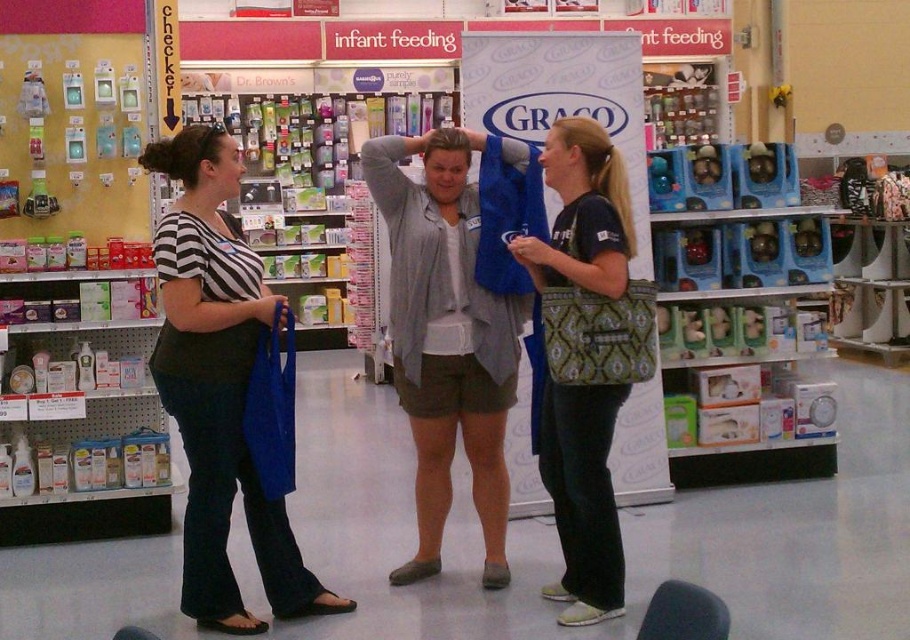
Question: Which of the following is the closest to the observer?

Choices:
 (A) (603, 605)
 (B) (228, 397)

Answer: (B)

Question: Can you confirm if matte black shirt at left is thinner than matte green bag at center?

Choices:
 (A) yes
 (B) no

Answer: (B)

Question: Can you confirm if matte black shirt at left is wider than matte green bag at center?

Choices:
 (A) no
 (B) yes

Answer: (B)

Question: Is matte black shirt at left to the right of matte green bag at center from the viewer's perspective?

Choices:
 (A) no
 (B) yes

Answer: (A)

Question: Which point is closer to the camera?

Choices:
 (A) matte green bag at center
 (B) matte black shirt at left

Answer: (A)